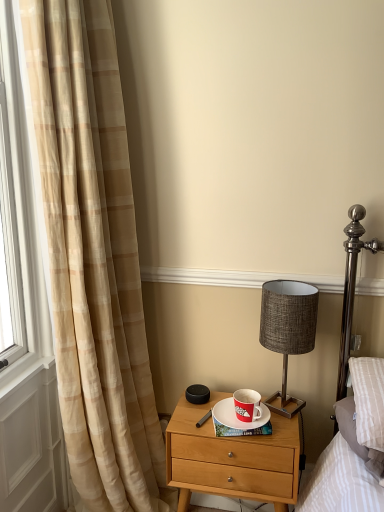
The width and height of the screenshot is (384, 512). Find the location of `vacant space to the right of white ceramic saucer at center`. vacant space to the right of white ceramic saucer at center is located at coordinates (284, 418).